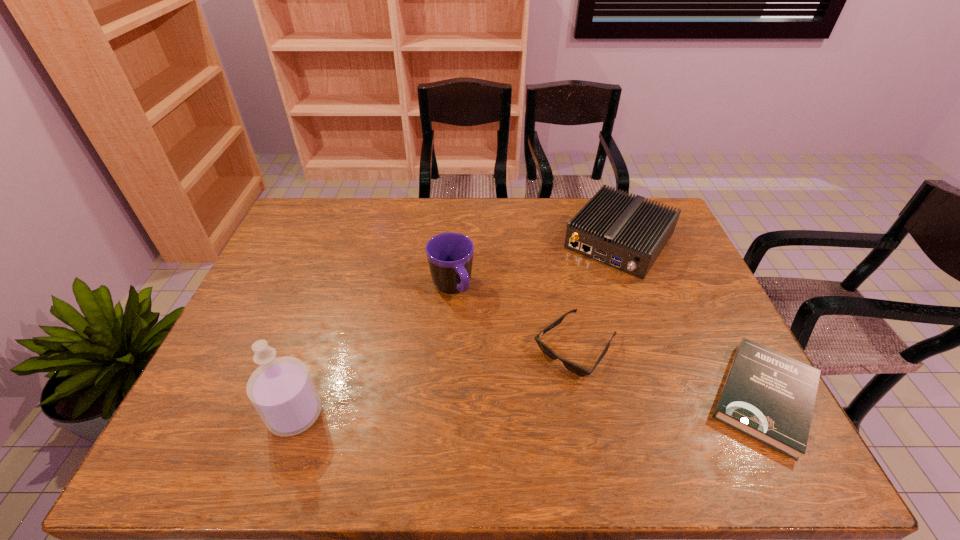
You are a GUI agent. You are given a task and a screenshot of the screen. Output one action in this format:
    pyautogui.click(x=<x>, y=<y>)
    Task: Click on the vacant area that satisfies the following two spatial constraints: 1. on the front side of the shortest object; 2. on the left side of the third tallest object
    This screenshot has height=540, width=960.
    Given the screenshot: What is the action you would take?
    pyautogui.click(x=678, y=397)

You are a GUI agent. You are given a task and a screenshot of the screen. Output one action in this format:
    pyautogui.click(x=<x>, y=<y>)
    Task: Click on the blank space that satisfies the following two spatial constraints: 1. on the front side of the mug; 2. on the right side of the shortest object
    
    Given the screenshot: What is the action you would take?
    pyautogui.click(x=444, y=397)

Where is `vacant space that satisfies the following two spatial constraints: 1. on the front side of the sunglasses; 2. on the left side of the book`? Image resolution: width=960 pixels, height=540 pixels. vacant space that satisfies the following two spatial constraints: 1. on the front side of the sunglasses; 2. on the left side of the book is located at coordinates (585, 397).

The height and width of the screenshot is (540, 960). In order to click on vacant region that satisfies the following two spatial constraints: 1. on the front side of the third tallest object; 2. on the right side of the book in this screenshot , I will do `click(678, 397)`.